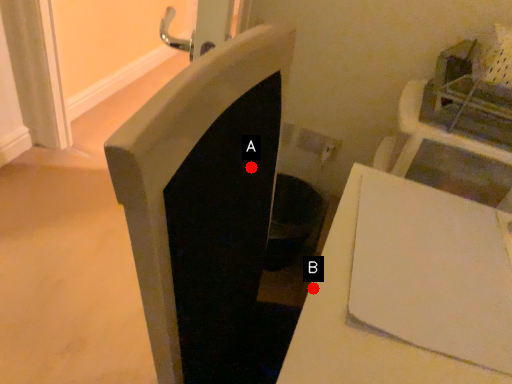
Question: Two points are circled on the image, labeled by A and B beside each circle. Among these points, which one is farthest from the camera?

Choices:
 (A) A is further
 (B) B is further

Answer: (B)